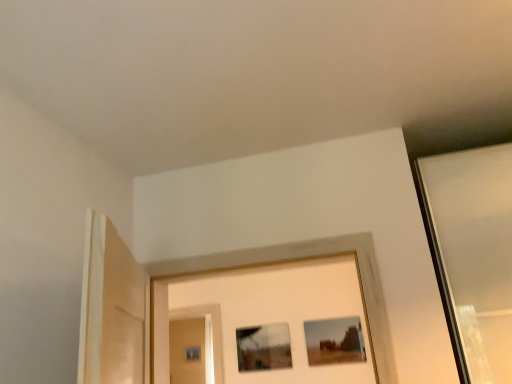
Question: From the image's perspective, does matte brown picture frame at center, which is counted as the 2th picture frame, starting from the left, appear higher than matte glass screen door at center?

Choices:
 (A) no
 (B) yes

Answer: (B)

Question: From a real-world perspective, is matte brown picture frame at center, the 1th picture frame from the right, over matte glass screen door at center?

Choices:
 (A) no
 (B) yes

Answer: (B)

Question: Is matte brown picture frame at center, which is counted as the 2th picture frame, starting from the left, to the right of matte glass screen door at center from the viewer's perspective?

Choices:
 (A) yes
 (B) no

Answer: (A)

Question: Is matte brown picture frame at center, the 1th picture frame from the right, not close to matte glass screen door at center?

Choices:
 (A) yes
 (B) no

Answer: (B)

Question: Is matte brown picture frame at center, the 1th picture frame from the right, located outside matte glass screen door at center?

Choices:
 (A) yes
 (B) no

Answer: (A)

Question: Based on their positions, is matte glass picture frame at center, which is counted as the 1th picture frame, starting from the left, located to the left or right of matte glass screen door at center?

Choices:
 (A) right
 (B) left

Answer: (A)

Question: In the image, is matte glass picture frame at center, which appears as the 2th picture frame when viewed from the right, positioned in front of or behind matte glass screen door at center?

Choices:
 (A) behind
 (B) front

Answer: (B)

Question: In terms of height, does matte glass picture frame at center, which appears as the 2th picture frame when viewed from the right, look taller or shorter compared to matte glass screen door at center?

Choices:
 (A) tall
 (B) short

Answer: (B)

Question: From a real-world perspective, relative to matte glass screen door at center, is matte glass picture frame at center, which appears as the 2th picture frame when viewed from the right, vertically above or below?

Choices:
 (A) above
 (B) below

Answer: (A)

Question: Which is correct: matte brown picture frame at center, the 1th picture frame from the right, is inside matte glass picture frame at center, which appears as the 2th picture frame when viewed from the right, or outside of it?

Choices:
 (A) inside
 (B) outside

Answer: (B)

Question: In terms of width, does matte brown picture frame at center, which is counted as the 2th picture frame, starting from the left, look wider or thinner when compared to matte glass picture frame at center, which appears as the 2th picture frame when viewed from the right?

Choices:
 (A) thin
 (B) wide

Answer: (A)

Question: From the image's perspective, is matte brown picture frame at center, which is counted as the 2th picture frame, starting from the left, positioned above or below matte glass picture frame at center, which appears as the 2th picture frame when viewed from the right?

Choices:
 (A) above
 (B) below

Answer: (A)

Question: From their relative heights in the image, would you say matte brown picture frame at center, the 1th picture frame from the right, is taller or shorter than matte glass picture frame at center, which appears as the 2th picture frame when viewed from the right?

Choices:
 (A) short
 (B) tall

Answer: (A)

Question: Is matte glass picture frame at center, which appears as the 2th picture frame when viewed from the right, wider or thinner than matte brown picture frame at center, the 1th picture frame from the right?

Choices:
 (A) wide
 (B) thin

Answer: (A)

Question: Considering the positions of matte glass picture frame at center, which appears as the 2th picture frame when viewed from the right, and matte brown picture frame at center, which is counted as the 2th picture frame, starting from the left, in the image, is matte glass picture frame at center, which appears as the 2th picture frame when viewed from the right, bigger or smaller than matte brown picture frame at center, which is counted as the 2th picture frame, starting from the left,?

Choices:
 (A) big
 (B) small

Answer: (A)